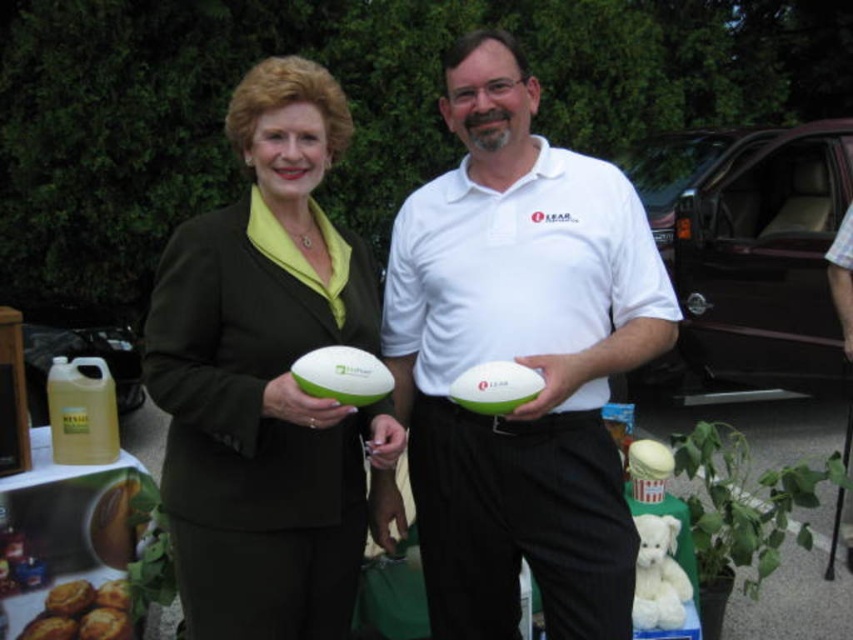
You are a food delivery person who needs to place a golden brown muffin at lower left into a container. The container can only fit items smaller than the white matte polo shirt at center. Will the muffin fit?

The golden brown muffin at lower left is smaller than the white matte polo shirt at center, so it will fit in the container.

You are a photographer taking a photo of the scene. You want to focus on the white matte polo shirt at center and the golden brown bread at lower left. Which object should you adjust your camera focus on first to ensure both are in focus?

The white matte polo shirt at center is closer to the viewer than the golden brown bread at lower left. To ensure both are in focus, you should focus on the golden brown bread at lower left first since it is farther away, allowing the depth of field to cover both objects.

Please describe the location of the white matte polo shirt at center in the image using coordinates. The coordinate system has the origin at the bottom left corner of the image, with x increasing to the right and y increasing upwards. The image has a width of 1.0 and height of 1.0. The answer should be in the format of coordinates within parentheses, like so, for example, if it were at the center, you would write the coordinates as follows. Please strictly follow the format and only provide the coordinates.

The white matte polo shirt at center is located at coordinates point (519,358).